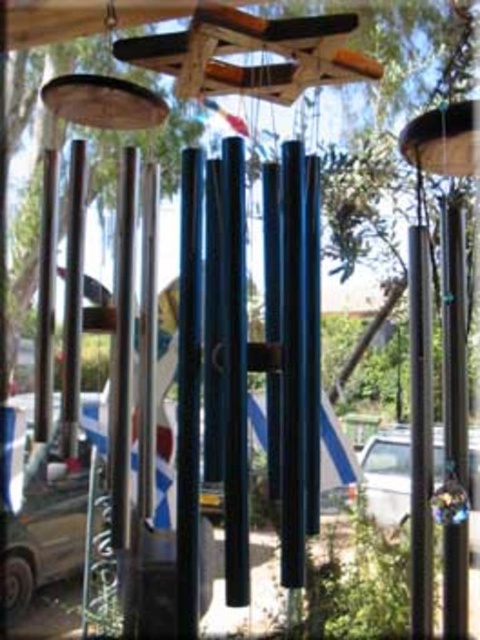
You are standing in front of the wind chimes and notice two poles. The black polished pole at right and the polished metal pole at center. Which pole is positioned to the right of the other?

The black polished pole at right is positioned to the right of the polished metal pole at center.

You are standing in front of the wind chimes and want to take a photo of the metallic silver car at lower left without including the wind chimes in the frame. How far back should you move from the wind chimes to ensure the car is fully visible?

The metallic silver car at lower left is 10.07 feet away from the camera. To ensure the car is fully visible without the wind chimes, you should move back at least 10.07 feet from the wind chimes.

You are standing in a garden and see the black polished pole at right and the white glossy car at center. Which object is closer to you?

Answer: The black polished pole at right is closer to you because it is in front of the white glossy car at center.